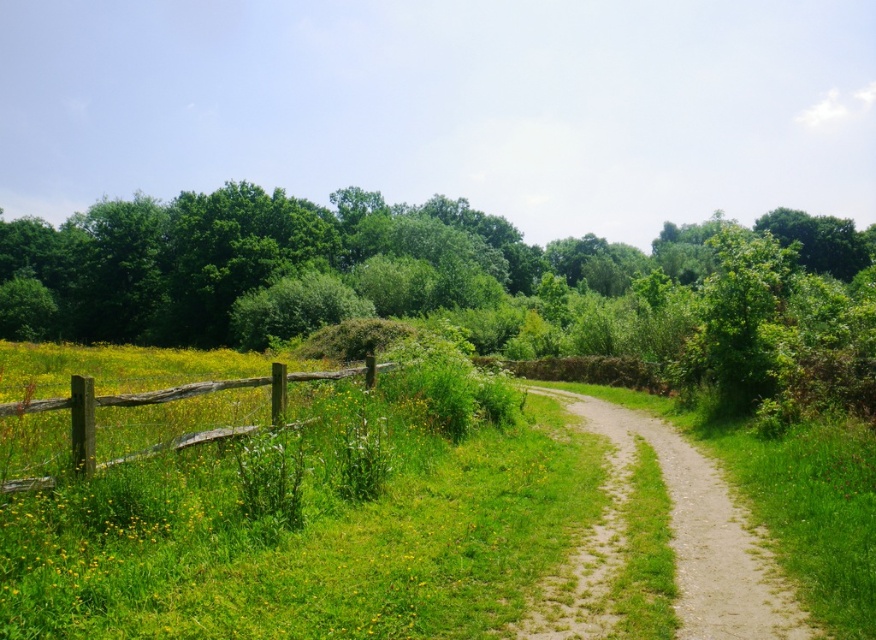
Question: Can you confirm if green leafy tree at center is positioned to the left of dirt/gravel path at center?

Choices:
 (A) no
 (B) yes

Answer: (A)

Question: Considering the real-world distances, which object is farthest from the weathered wood fence at left?

Choices:
 (A) green leafy tree at center
 (B) dirt/gravel path at center

Answer: (A)

Question: Which point is closer to the camera?

Choices:
 (A) (133, 243)
 (B) (81, 384)

Answer: (B)

Question: Can you confirm if green leafy tree at center is positioned below weathered wood fence at left?

Choices:
 (A) no
 (B) yes

Answer: (A)

Question: Is green leafy tree at center smaller than weathered wood fence at left?

Choices:
 (A) no
 (B) yes

Answer: (A)

Question: Which point is farther to the camera?

Choices:
 (A) dirt/gravel path at center
 (B) weathered wood fence at left
 (C) green leafy tree at center

Answer: (C)